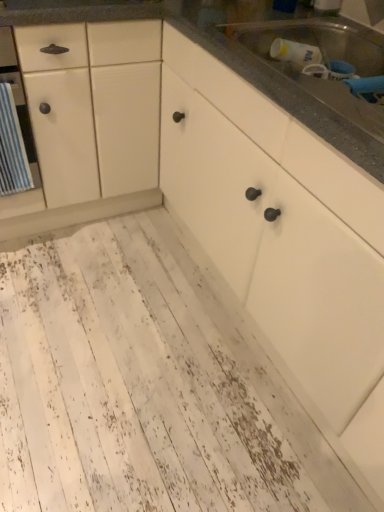
Question: Does metallic stainless steel sink at upper right have a greater height compared to white distressed wood floor at lower left?

Choices:
 (A) no
 (B) yes

Answer: (B)

Question: Could white distressed wood floor at lower left be considered to be inside metallic stainless steel sink at upper right?

Choices:
 (A) yes
 (B) no

Answer: (B)

Question: From a real-world perspective, is metallic stainless steel sink at upper right on white distressed wood floor at lower left?

Choices:
 (A) no
 (B) yes

Answer: (B)

Question: Does metallic stainless steel sink at upper right appear on the right side of white distressed wood floor at lower left?

Choices:
 (A) no
 (B) yes

Answer: (B)

Question: Does metallic stainless steel sink at upper right have a lesser height compared to white distressed wood floor at lower left?

Choices:
 (A) yes
 (B) no

Answer: (B)

Question: Considering their positions, is metallic stainless steel sink at upper right located in front of or behind white wood countertop at upper right?

Choices:
 (A) front
 (B) behind

Answer: (A)

Question: Do you think metallic stainless steel sink at upper right is within white wood countertop at upper right, or outside of it?

Choices:
 (A) inside
 (B) outside

Answer: (B)

Question: Is metallic stainless steel sink at upper right bigger or smaller than white wood countertop at upper right?

Choices:
 (A) big
 (B) small

Answer: (B)

Question: Does point (360, 40) appear closer or farther from the camera than point (367, 44)?

Choices:
 (A) farther
 (B) closer

Answer: (A)

Question: Considering the positions of white wood countertop at upper right and white distressed wood floor at lower left in the image, is white wood countertop at upper right wider or thinner than white distressed wood floor at lower left?

Choices:
 (A) wide
 (B) thin

Answer: (B)

Question: Considering the positions of point coord(268,68) and point coord(61,329), is point coord(268,68) closer or farther from the camera than point coord(61,329)?

Choices:
 (A) closer
 (B) farther

Answer: (A)

Question: In terms of height, does white wood countertop at upper right look taller or shorter compared to white distressed wood floor at lower left?

Choices:
 (A) tall
 (B) short

Answer: (A)

Question: Do you think white wood countertop at upper right is within white distressed wood floor at lower left, or outside of it?

Choices:
 (A) inside
 (B) outside

Answer: (B)

Question: From the image's perspective, is white distressed wood floor at lower left positioned above or below white wood countertop at upper right?

Choices:
 (A) below
 (B) above

Answer: (A)

Question: Based on their sizes in the image, would you say white distressed wood floor at lower left is bigger or smaller than white wood countertop at upper right?

Choices:
 (A) big
 (B) small

Answer: (B)